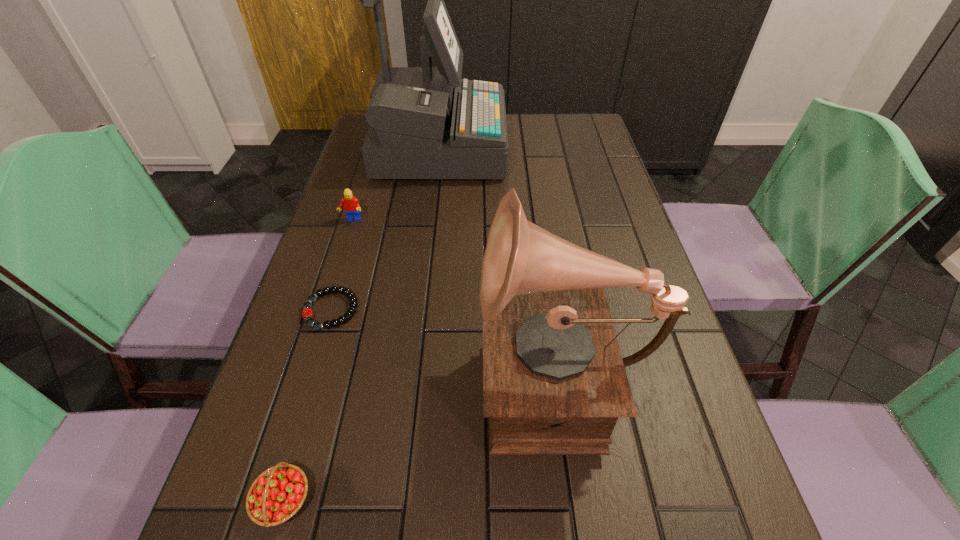
You are a GUI agent. You are given a task and a screenshot of the screen. Output one action in this format:
    pyautogui.click(x=<x>, y=<y>)
    Task: Click on the free space located on the horn of the record player
    The image size is (960, 540).
    Given the screenshot: What is the action you would take?
    pyautogui.click(x=410, y=372)

Where is `vacant space located 0.260m on the front-facing side of the Lego`? The image size is (960, 540). vacant space located 0.260m on the front-facing side of the Lego is located at coordinates (326, 301).

Find the location of a particular element. free region located 0.280m on the right of the nearest object is located at coordinates (497, 500).

Where is `free space located on the back of the shortest object`? The height and width of the screenshot is (540, 960). free space located on the back of the shortest object is located at coordinates (354, 233).

Where is `object present at the far edge`? object present at the far edge is located at coordinates (426, 122).

At what (x,y) coordinates should I click in order to perform the action: click on cash register that is at the left edge. Please return your answer as a coordinate pair (x, y). The height and width of the screenshot is (540, 960). Looking at the image, I should click on (426, 122).

Locate an element on the screen. Lego that is at the left edge is located at coordinates (351, 205).

Locate an element on the screen. strawberry positioned at the left edge is located at coordinates (277, 494).

Where is `bracelet at the left edge`? The width and height of the screenshot is (960, 540). bracelet at the left edge is located at coordinates (307, 313).

This screenshot has height=540, width=960. Identify the location of object located at the right edge. (554, 382).